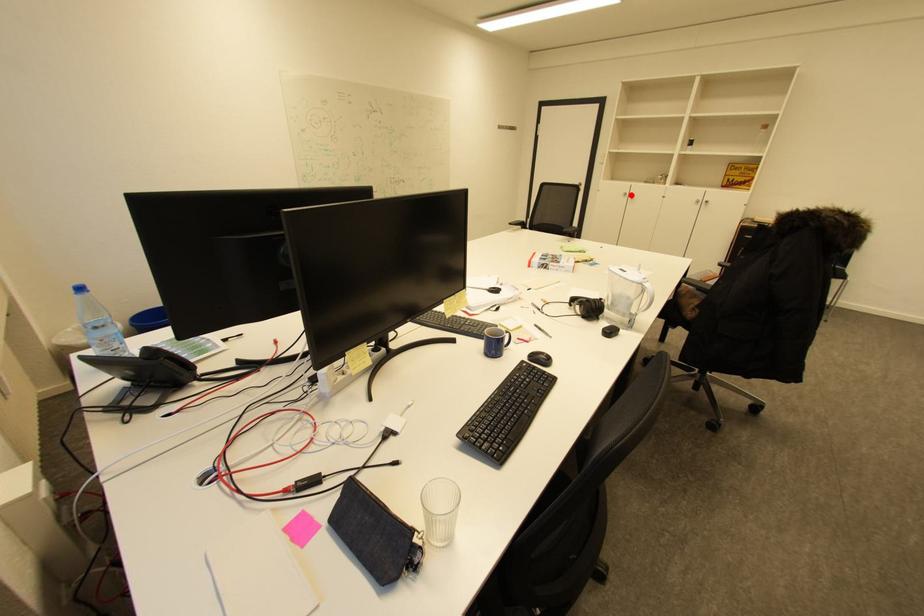
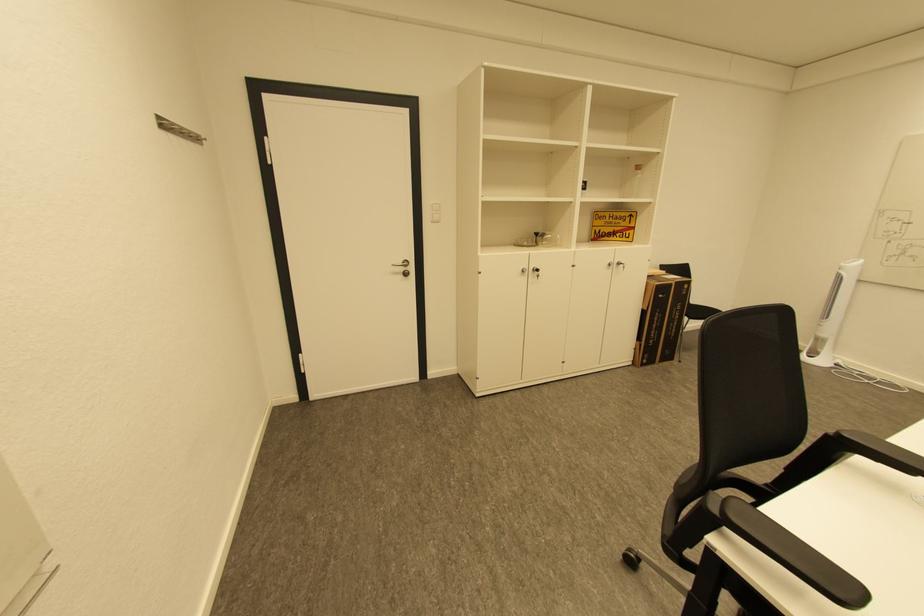
Locate, in the second image, the point that corresponds to the highlighted location in the first image.

(529, 272)